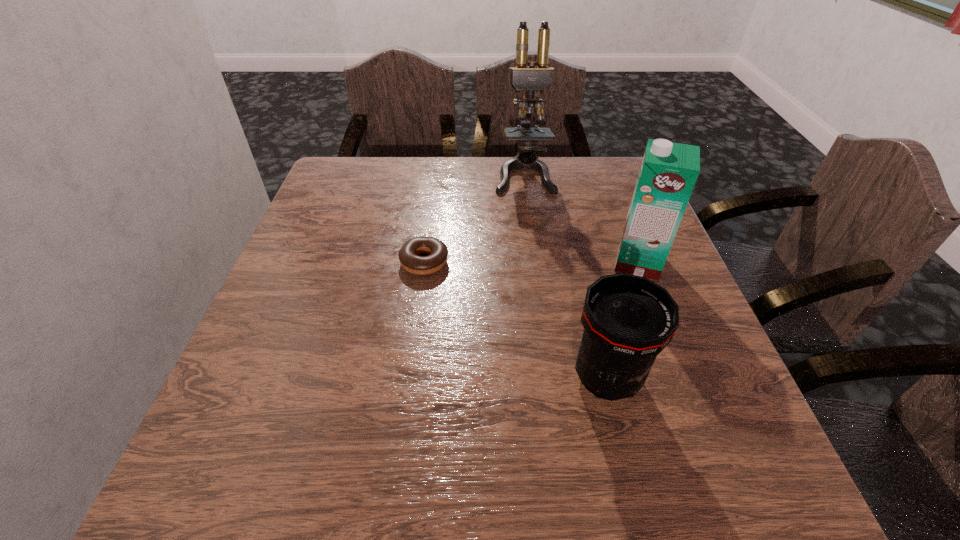
The height and width of the screenshot is (540, 960). I want to click on blank area located on the left of the telephoto lens, so click(510, 377).

This screenshot has height=540, width=960. In order to click on free space located on the front of the shortest object in this screenshot , I will do `click(408, 387)`.

The image size is (960, 540). Identify the location of object that is at the far edge. (528, 79).

Find the location of `carton that is at the right edge`. carton that is at the right edge is located at coordinates (668, 173).

Find the location of `telephoto lens at the right edge`. telephoto lens at the right edge is located at coordinates (628, 320).

What are the coordinates of `blank space at the far edge` in the screenshot? It's located at (416, 188).

You are a GUI agent. You are given a task and a screenshot of the screen. Output one action in this format:
    pyautogui.click(x=<x>, y=<y>)
    Task: Click on the free space at the left edge of the desktop
    This screenshot has height=540, width=960.
    Given the screenshot: What is the action you would take?
    pyautogui.click(x=299, y=313)

Image resolution: width=960 pixels, height=540 pixels. In order to click on free space at the right edge of the desktop in this screenshot , I will do `click(731, 415)`.

Find the location of a particular element. The height and width of the screenshot is (540, 960). free space at the far left corner is located at coordinates (367, 163).

You are a GUI agent. You are given a task and a screenshot of the screen. Output one action in this format:
    pyautogui.click(x=<x>, y=<y>)
    Task: Click on the vacant position at the near left corner of the desktop
    Image resolution: width=960 pixels, height=540 pixels.
    Given the screenshot: What is the action you would take?
    pyautogui.click(x=294, y=485)